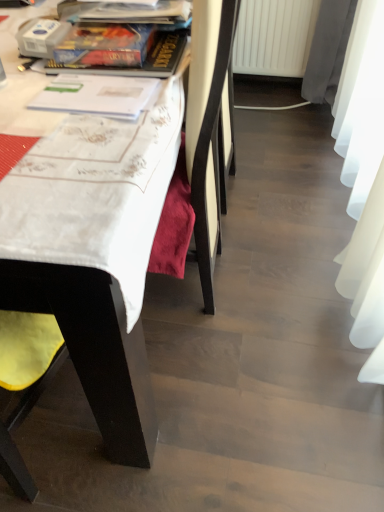
Question: Does matte plastic book at upper center, positioned as the 2th book in front-to-back order, have a greater height compared to yellow fabric chair at left?

Choices:
 (A) yes
 (B) no

Answer: (B)

Question: From a real-world perspective, is matte plastic book at upper center, the 1th book when ordered from back to front, beneath yellow fabric chair at left?

Choices:
 (A) yes
 (B) no

Answer: (B)

Question: From the image's perspective, is matte plastic book at upper center, arranged as the 2th book when ordered from the bottom, below yellow fabric chair at left?

Choices:
 (A) no
 (B) yes

Answer: (A)

Question: Is matte plastic book at upper center, positioned as the 2th book in front-to-back order, at the left side of yellow fabric chair at left?

Choices:
 (A) yes
 (B) no

Answer: (B)

Question: In the image, is white plastic radiator at lower center on the left side or the right side of yellow fabric chair at left?

Choices:
 (A) left
 (B) right

Answer: (B)

Question: Is white plastic radiator at lower center wider or thinner than yellow fabric chair at left?

Choices:
 (A) thin
 (B) wide

Answer: (A)

Question: From their relative heights in the image, would you say white plastic radiator at lower center is taller or shorter than yellow fabric chair at left?

Choices:
 (A) short
 (B) tall

Answer: (A)

Question: In the image, is white plastic radiator at lower center positioned in front of or behind yellow fabric chair at left?

Choices:
 (A) behind
 (B) front

Answer: (A)

Question: Would you say yellow fabric chair at left is inside or outside white plastic radiator at lower center?

Choices:
 (A) outside
 (B) inside

Answer: (A)

Question: Considering the positions of point (3, 182) and point (241, 70), is point (3, 182) closer or farther from the camera than point (241, 70)?

Choices:
 (A) closer
 (B) farther

Answer: (A)

Question: In terms of height, does yellow fabric chair at left look taller or shorter compared to white plastic radiator at lower center?

Choices:
 (A) short
 (B) tall

Answer: (B)

Question: From the image's perspective, is yellow fabric chair at left positioned above or below white plastic radiator at lower center?

Choices:
 (A) above
 (B) below

Answer: (B)

Question: Is white plastic radiator at lower center to the left or to the right of matte plastic book at upper center, placed as the first book when sorted from top to bottom, in the image?

Choices:
 (A) right
 (B) left

Answer: (A)

Question: In the image, is white plastic radiator at lower center positioned in front of or behind matte plastic book at upper center, positioned as the 2th book in front-to-back order?

Choices:
 (A) front
 (B) behind

Answer: (B)